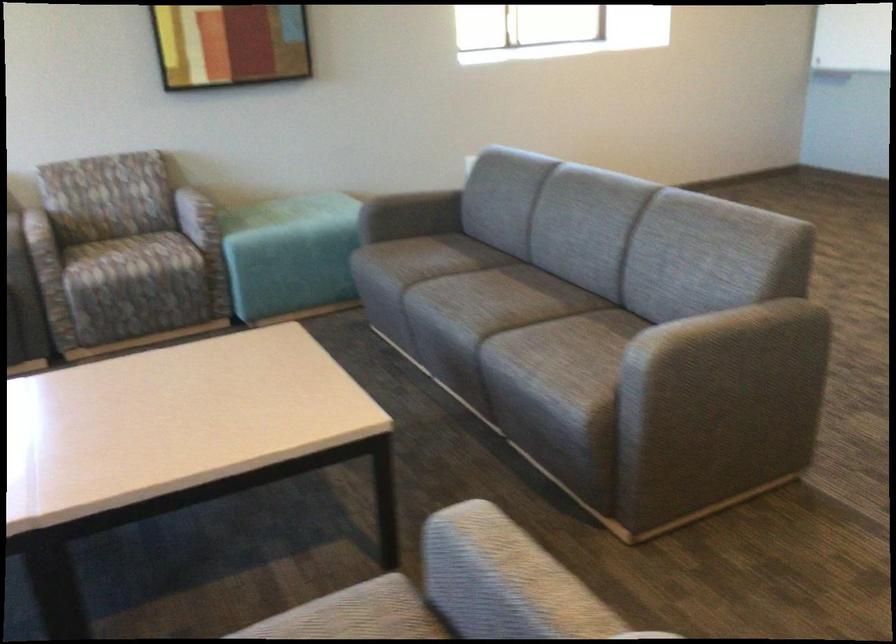
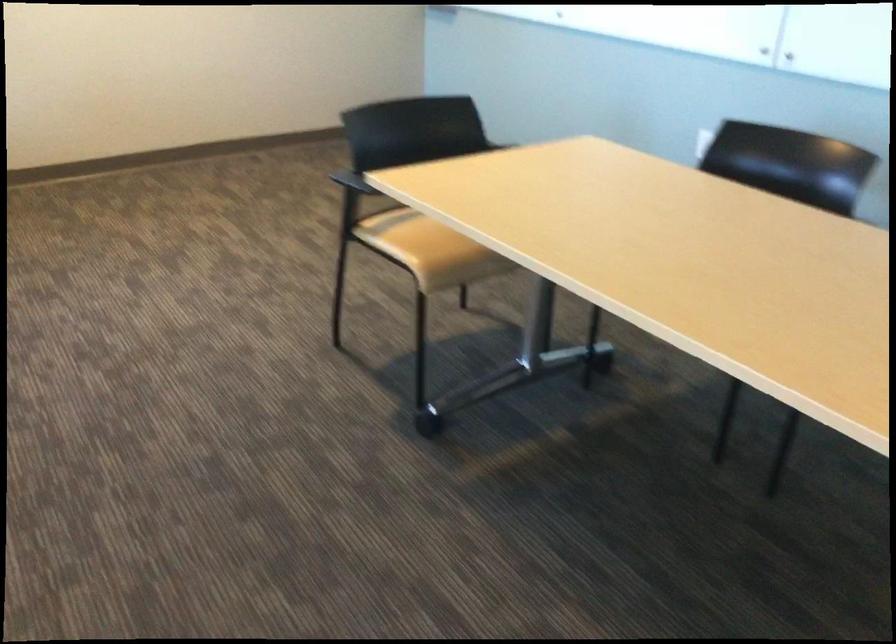
Question: The images are taken continuously from a first-person perspective. In which direction are you moving?

Choices:
 (A) Left
 (B) Right
 (C) Forward
 (D) Backward

Answer: (B)